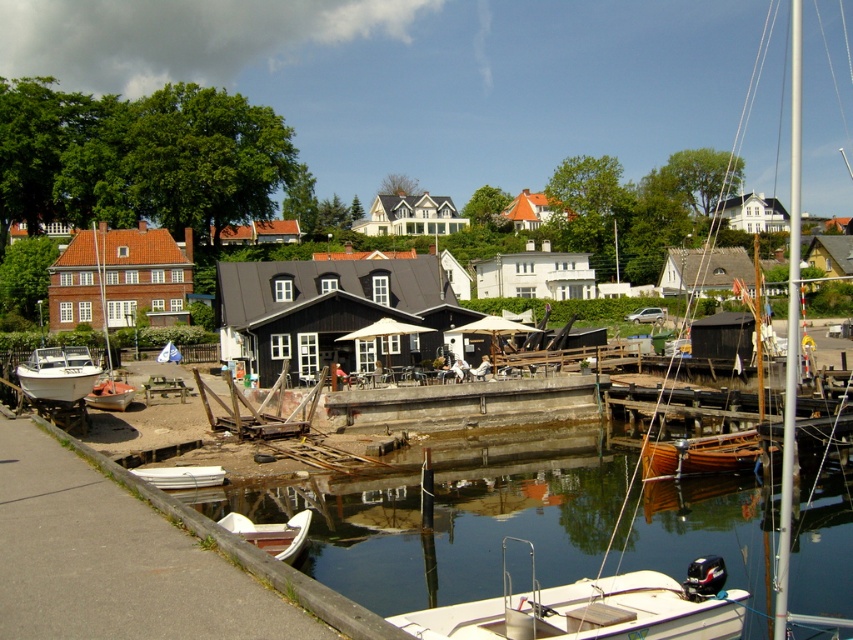
Which is more to the left, white plastic boat at lower center or white matte boat at lower left?

From the viewer's perspective, white matte boat at lower left appears more on the left side.

This screenshot has width=853, height=640. I want to click on white plastic boat at lower center, so click(593, 608).

Which is behind, point (94, 380) or point (114, 387)?

Positioned behind is point (114, 387).

Locate an element on the screen. white matte boat at left is located at coordinates (57, 372).

Who is more distant from viewer, (86, 378) or (111, 404)?

The point (111, 404) is more distant.

Find the location of a particular element. white matte boat at left is located at coordinates (57, 372).

Between point (804, 568) and point (42, 371), which one is positioned in front?

Point (804, 568) is in front.

Where is `smooth concrete dock at lower center`? smooth concrete dock at lower center is located at coordinates (448, 522).

This screenshot has height=640, width=853. Find the location of `smooth concrete dock at lower center`. smooth concrete dock at lower center is located at coordinates (448, 522).